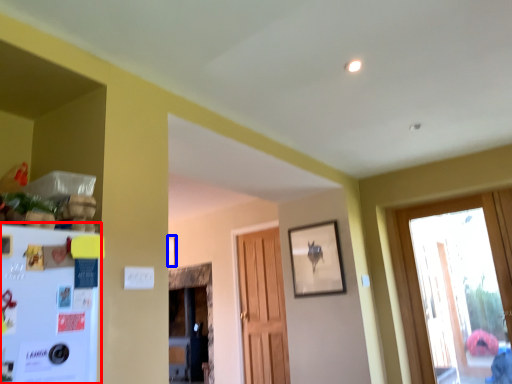
Question: Which object appears closest to the camera in this image, fridge (highlighted by a red box) or picture frame (highlighted by a blue box)?

Choices:
 (A) fridge
 (B) picture frame

Answer: (A)